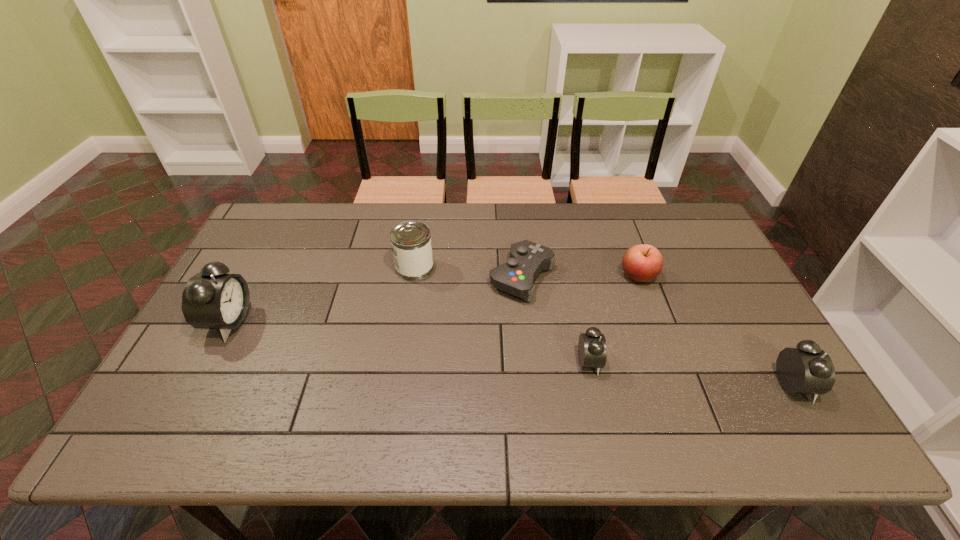
You are a GUI agent. You are given a task and a screenshot of the screen. Output one action in this format:
    pyautogui.click(x=<x>, y=<y>)
    Task: Click on the free space that is in between the apple and the second tallest alarm clock
    
    Given the screenshot: What is the action you would take?
    pyautogui.click(x=716, y=330)

Identify the location of blank region between the second alarm clock from right to left and the apple. (613, 319).

This screenshot has width=960, height=540. What are the coordinates of `vacant space in between the fourth object from left to right and the control` in the screenshot? It's located at (556, 320).

Locate which object is the third closest to the fourth object from right to left. Please provide its 2D coordinates. Your answer should be formatted as a tuple, i.e. [(x, y)], where the tuple contains the x and y coordinates of a point satisfying the conditions above.

[(643, 262)]

Locate an element on the screen. The image size is (960, 540). object that is the second nearest to the second alarm clock from right to left is located at coordinates (643, 262).

Identify which alarm clock is located as the third nearest to the can. Please provide its 2D coordinates. Your answer should be formatted as a tuple, i.e. [(x, y)], where the tuple contains the x and y coordinates of a point satisfying the conditions above.

[(807, 369)]

Identify which alarm clock is located as the nearest to the fourth object from left to right. Please provide its 2D coordinates. Your answer should be formatted as a tuple, i.e. [(x, y)], where the tuple contains the x and y coordinates of a point satisfying the conditions above.

[(807, 369)]

Find the location of `free space that satisfies the following two spatial constraints: 1. on the front side of the third object from left to right; 2. on the front side of the farthest alarm clock`. free space that satisfies the following two spatial constraints: 1. on the front side of the third object from left to right; 2. on the front side of the farthest alarm clock is located at coordinates click(x=527, y=321).